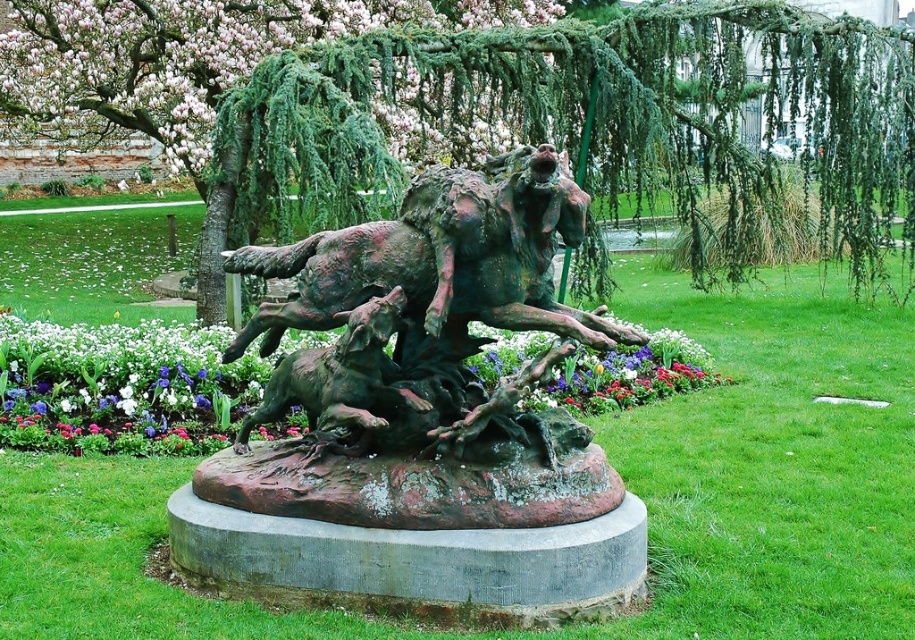
Based on the photo, you are a gardener observing the sculpture and want to place a decorative stone between the pink blossoms at upper left and the matte green leaves at center. Based on their positions, where should you place the stone relative to the leaves?

The pink blossoms at upper left are located above the matte green leaves at center, so you should place the decorative stone below the pink blossoms at upper left and above the matte green leaves at center to position it between them.

You are an artist planning to sketch the sculpture in the garden. You need to place the matte green leaves at center in your drawing. Where should you position them on a coordinate grid where the bottom left corner is the origin?

The matte green leaves at center should be positioned at the coordinate point of 0.606 on the x axis and 0.133 on the y axis.